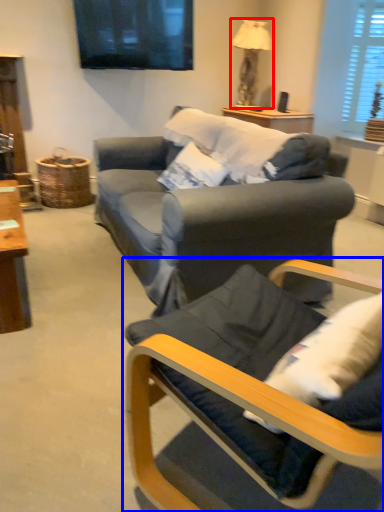
Question: Which object appears farthest to the camera in this image, lamp (highlighted by a red box) or chair (highlighted by a blue box)?

Choices:
 (A) lamp
 (B) chair

Answer: (A)